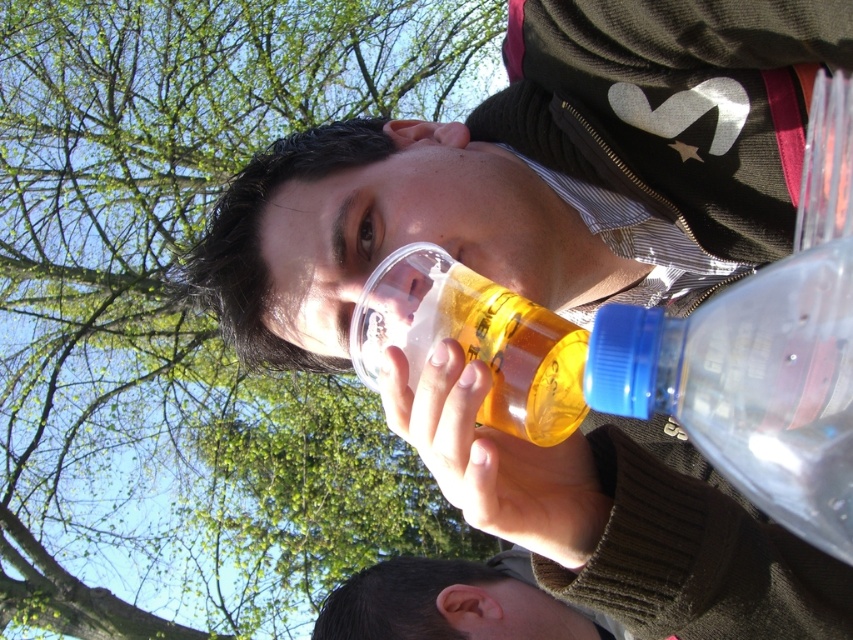
Question: Which of the following is the farthest from the observer?

Choices:
 (A) (817, 307)
 (B) (532, 417)

Answer: (B)

Question: Is transparent plastic bottle at right thinner than translucent plastic cup at upper center?

Choices:
 (A) no
 (B) yes

Answer: (A)

Question: Which object is farther from the camera taking this photo?

Choices:
 (A) translucent plastic cup at upper center
 (B) transparent plastic bottle at right

Answer: (A)

Question: Is transparent plastic bottle at right thinner than translucent plastic cup at upper center?

Choices:
 (A) no
 (B) yes

Answer: (A)

Question: Is transparent plastic bottle at right to the left of translucent plastic cup at upper center from the viewer's perspective?

Choices:
 (A) yes
 (B) no

Answer: (B)